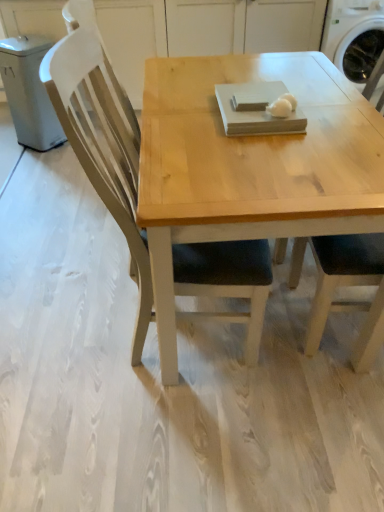
The width and height of the screenshot is (384, 512). Identify the location of vacant position to the left of matte wood chair at right. (255, 360).